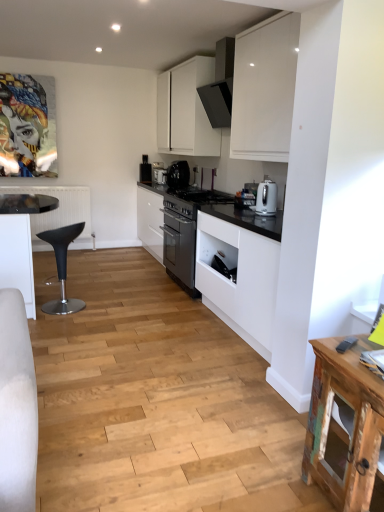
Question: Relative to white matte cabinet at upper center, is black plastic bar stool at left in front or behind?

Choices:
 (A) behind
 (B) front

Answer: (B)

Question: Is black plastic bar stool at left spatially inside white matte cabinet at upper center, or outside of it?

Choices:
 (A) inside
 (B) outside

Answer: (B)

Question: Which object is the closest to the satin black coffee maker at center, the second kitchen appliance positioned from the bottom?

Choices:
 (A) white matte cabinet at upper center
 (B) white glossy coffee maker at center, positioned as the first kitchen appliance in top-to-bottom order
 (C) black matte toaster at upper center
 (D) black plastic bar stool at left
 (E) satin silver kettle at right, which ranks as the 3th kitchen appliance in back-to-front order

Answer: (B)

Question: Estimate the real-world distances between objects in this image. Which object is farther from the white glossy coffee maker at center, positioned as the first kitchen appliance in top-to-bottom order?

Choices:
 (A) satin silver kettle at right, which is the 1th kitchen appliance in front-to-back order
 (B) black plastic bar stool at left
 (C) satin black coffee maker at center, the 2th kitchen appliance positioned from the front
 (D) black matte toaster at upper center
 (E) white matte cabinet at upper center

Answer: (A)